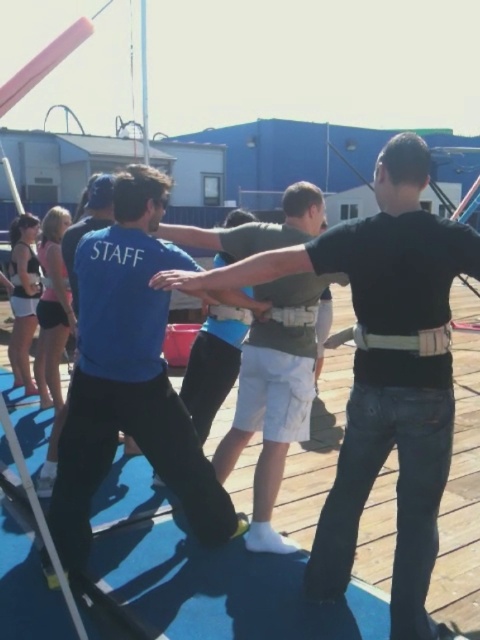
You are observing a team activity on a wooden deck where two participants are wearing harnesses. You see a black matte shirt at center and a matte black tank top at left. Which participant is closer to the front of the deck?

The black matte shirt at center is positioned under the matte black tank top at left, meaning the black matte shirt at center is closer to the front of the deck.

You are a participant in the team activity and need to communicate with the staff member. Which of the two people, the black matte shirt at center or the blue fabric shirt at center, is the staff member you should approach for assistance?

The blue fabric shirt at center is the staff member, so you should approach the blue fabric shirt at center for assistance.